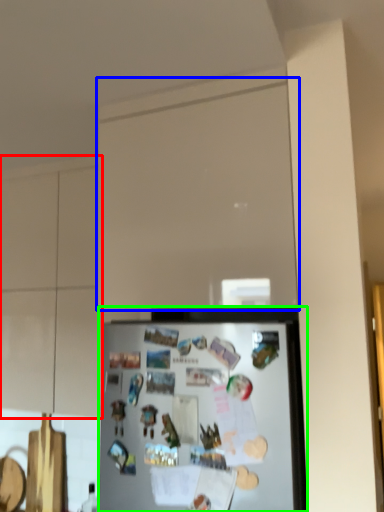
Question: Which object is the farthest from cabinetry (highlighted by a red box)? Choose among these: glass door (highlighted by a blue box) or refrigerator (highlighted by a green box).

Choices:
 (A) glass door
 (B) refrigerator

Answer: (B)